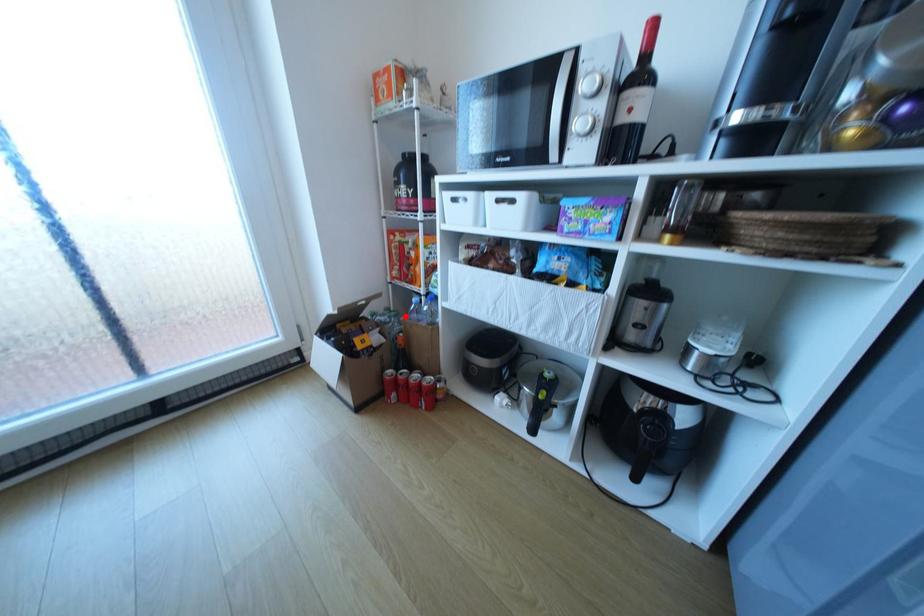
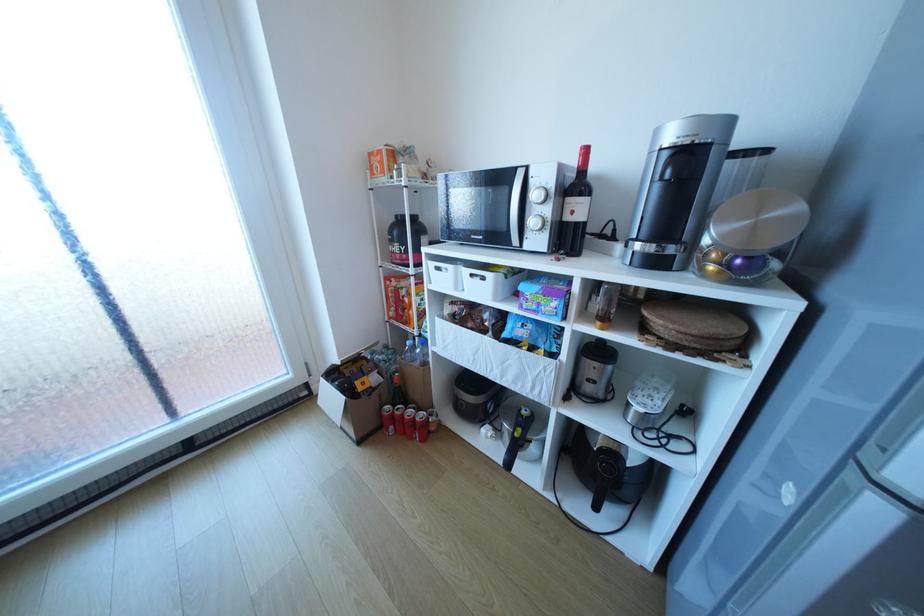
The point at the highlighted location is marked in the first image. Where is the corresponding point in the second image?

(402, 354)